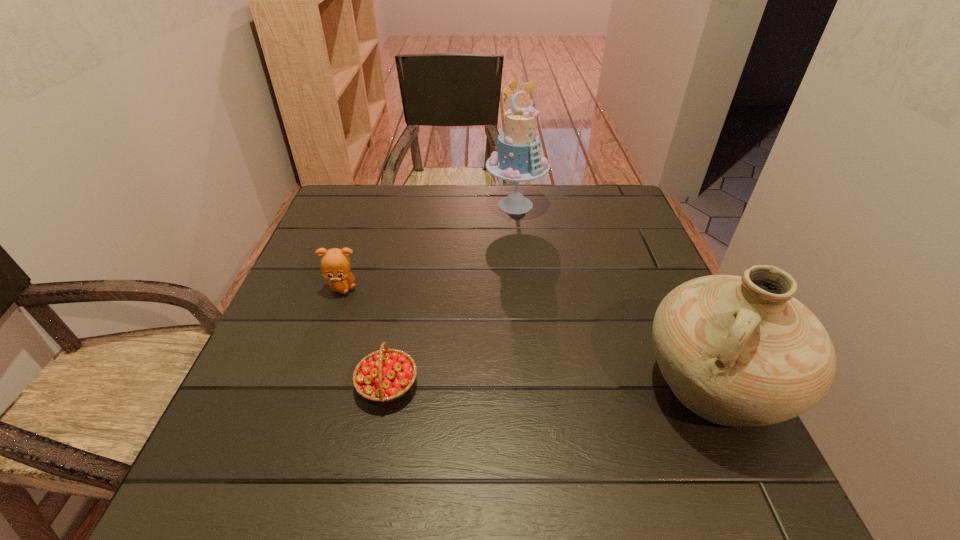
Find the location of a particular element. free space on the desktop that is between the strawberry and the second tallest object and is positioned with a ladder on the side of the farthest object is located at coordinates (584, 386).

The height and width of the screenshot is (540, 960). I want to click on free space on the desktop that is between the second object from left to right and the rightmost object and is positioned on the face of the second farthest object, so click(516, 385).